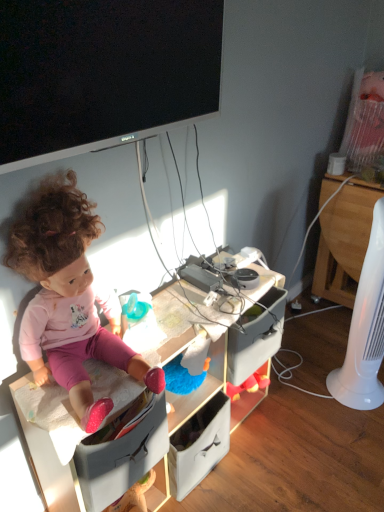
Question: Is pink fabric doll at left oriented towards wooden at right?

Choices:
 (A) no
 (B) yes

Answer: (A)

Question: Is pink fabric doll at left turned away from wooden at right?

Choices:
 (A) no
 (B) yes

Answer: (A)

Question: Can wooden at right be found inside pink fabric doll at left?

Choices:
 (A) yes
 (B) no

Answer: (B)

Question: Are pink fabric doll at left and wooden at right far apart?

Choices:
 (A) no
 (B) yes

Answer: (B)

Question: Is pink fabric doll at left in contact with wooden at right?

Choices:
 (A) no
 (B) yes

Answer: (A)

Question: From a real-world perspective, is pink fabric doll at left located beneath wooden at right?

Choices:
 (A) no
 (B) yes

Answer: (A)

Question: From the image's perspective, is wooden at right located beneath black glossy flat-screen tv at upper center?

Choices:
 (A) no
 (B) yes

Answer: (B)

Question: From a real-world perspective, is wooden at right over black glossy flat-screen tv at upper center?

Choices:
 (A) yes
 (B) no

Answer: (B)

Question: From the image's perspective, is wooden at right on top of black glossy flat-screen tv at upper center?

Choices:
 (A) no
 (B) yes

Answer: (A)

Question: Is wooden at right positioned far away from black glossy flat-screen tv at upper center?

Choices:
 (A) yes
 (B) no

Answer: (A)

Question: Could you tell me if wooden at right is turned towards black glossy flat-screen tv at upper center?

Choices:
 (A) no
 (B) yes

Answer: (B)

Question: Is black glossy flat-screen tv at upper center located within wooden at right?

Choices:
 (A) yes
 (B) no

Answer: (B)

Question: Considering the relative sizes of pink fabric doll at left and black glossy flat-screen tv at upper center in the image provided, is pink fabric doll at left wider than black glossy flat-screen tv at upper center?

Choices:
 (A) yes
 (B) no

Answer: (A)